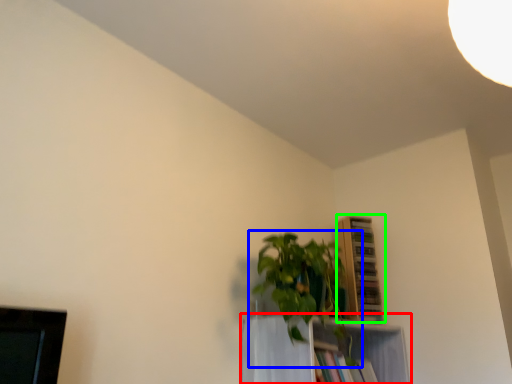
Question: Which is nearer to the shelf (highlighted by a red box)? houseplant (highlighted by a blue box) or shelf (highlighted by a green box).

Choices:
 (A) houseplant
 (B) shelf

Answer: (A)